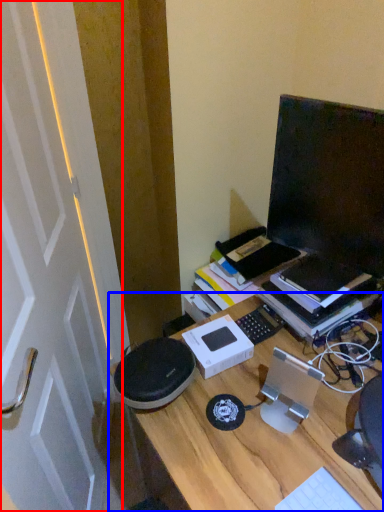
Question: Which point is closer to the camera, door (highlighted by a red box) or desk (highlighted by a blue box)?

Choices:
 (A) door
 (B) desk

Answer: (A)